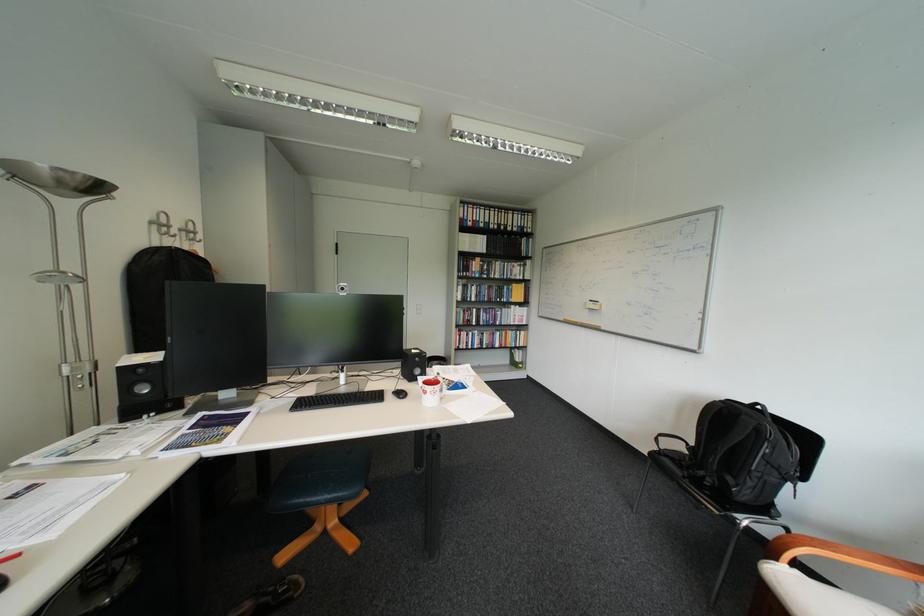
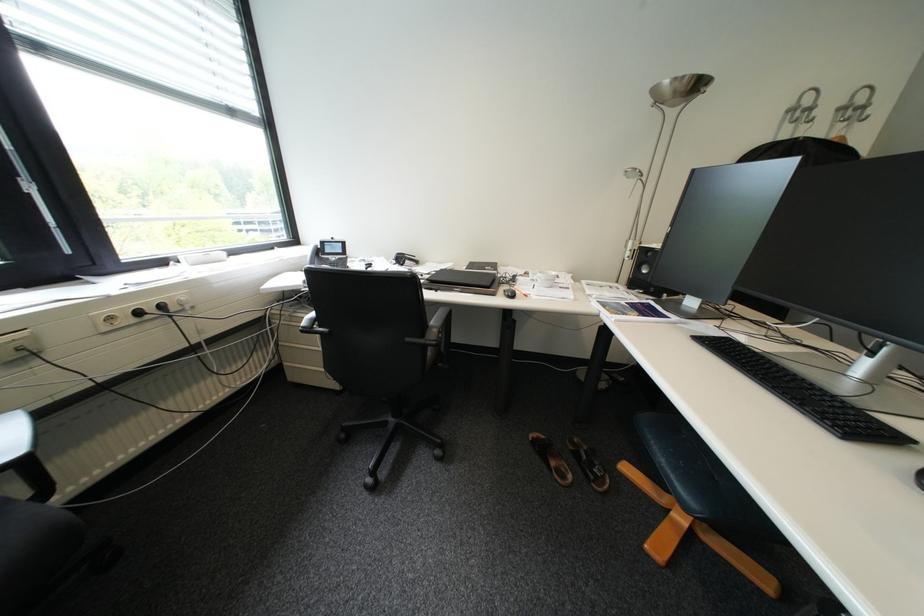
First-person continuous shooting, in which direction is the camera rotating?

The rotation direction of the camera is left-down.